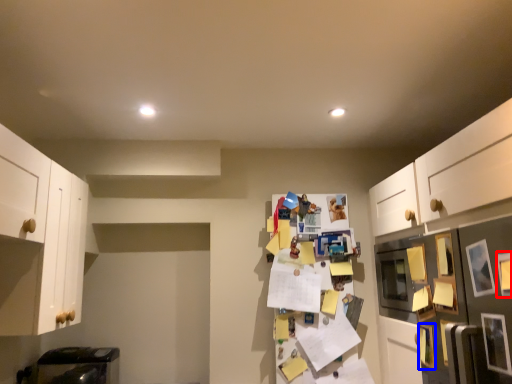
Question: Which of the following is the farthest to the observer, picture frame (highlighted by a red box) or picture frame (highlighted by a blue box)?

Choices:
 (A) picture frame
 (B) picture frame

Answer: (B)